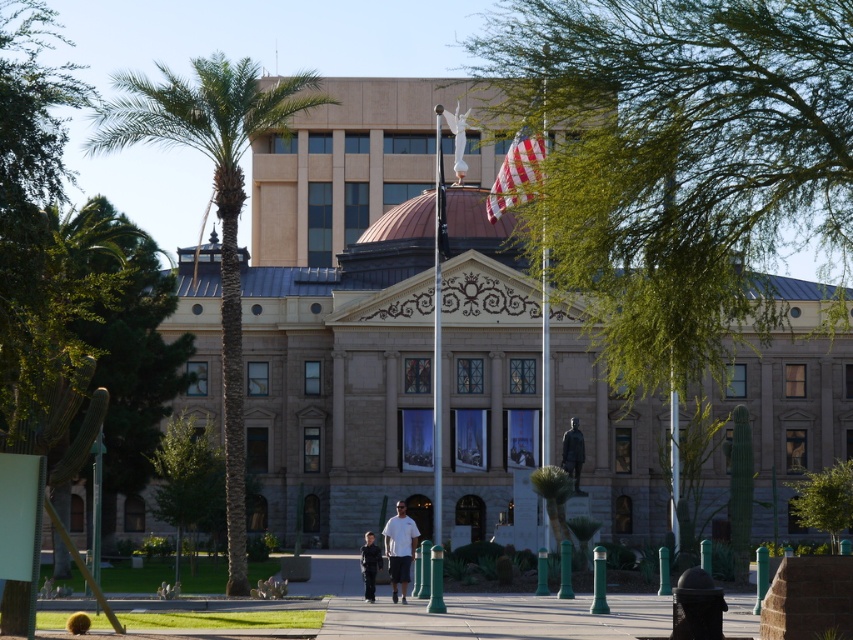
Question: Which of the following is the farthest from the observer?

Choices:
 (A) american flag at center
 (B) paved concrete sidewalk at center
 (C) bronze statue at center
 (D) light brown leather jacket at center

Answer: (C)

Question: Is green leafy palm tree at left positioned in front of paved concrete sidewalk at center?

Choices:
 (A) no
 (B) yes

Answer: (A)

Question: Considering the real-world distances, which object is closest to the american flag at center?

Choices:
 (A) bronze statue at center
 (B) green leafy tree at upper center
 (C) light brown leather jacket at center

Answer: (B)

Question: Which object appears farthest from the camera in this image?

Choices:
 (A) green leafy palm tree at left
 (B) american flag at center

Answer: (A)

Question: Does paved concrete sidewalk at center have a larger size compared to matte white shirt at center?

Choices:
 (A) no
 (B) yes

Answer: (B)

Question: Does green leafy tree at upper center appear on the left side of light brown leather jacket at center?

Choices:
 (A) yes
 (B) no

Answer: (B)